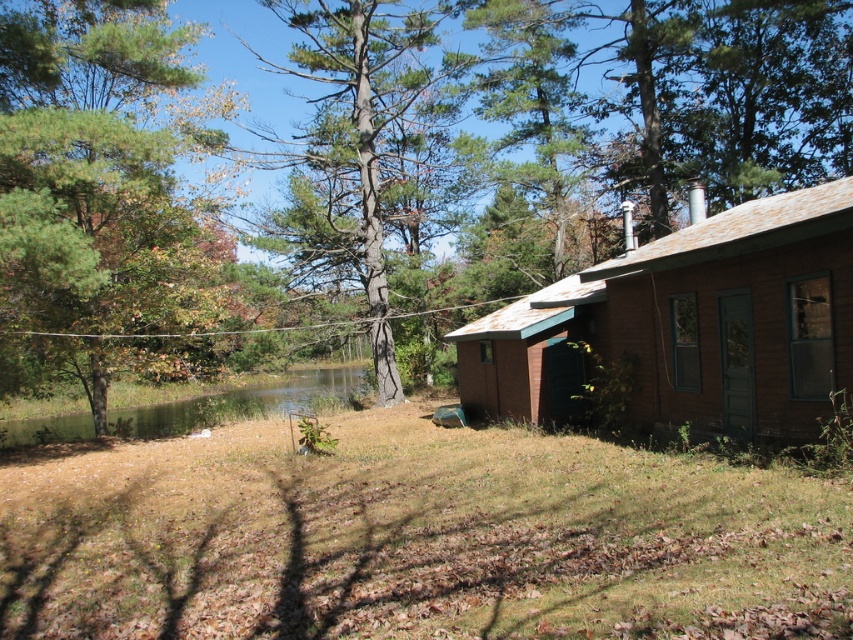
Question: Which of the following is the closest to the observer?

Choices:
 (A) (767, 260)
 (B) (844, 339)
 (C) (50, 193)

Answer: (B)

Question: Does green leafy tree at left come behind brown wooden cabin at right?

Choices:
 (A) no
 (B) yes

Answer: (B)

Question: Which point is farther to the camera?

Choices:
 (A) (202, 298)
 (B) (463, 346)
 (C) (686, 276)

Answer: (B)

Question: Can you confirm if green leafy tree at center is bigger than brown wooden cabin at right?

Choices:
 (A) yes
 (B) no

Answer: (A)

Question: Which of the following is the closest to the observer?

Choices:
 (A) [x=102, y=180]
 (B) [x=793, y=413]

Answer: (B)

Question: Considering the relative positions of green leafy tree at left and brown wooden cabin at right in the image provided, where is green leafy tree at left located with respect to brown wooden cabin at right?

Choices:
 (A) below
 (B) above

Answer: (B)